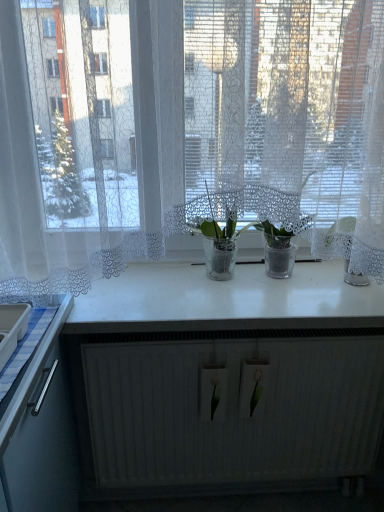
Where is `vacant location below transparent glass plants at center (from a real-world perspective)`? The image size is (384, 512). vacant location below transparent glass plants at center (from a real-world perspective) is located at coordinates (246, 310).